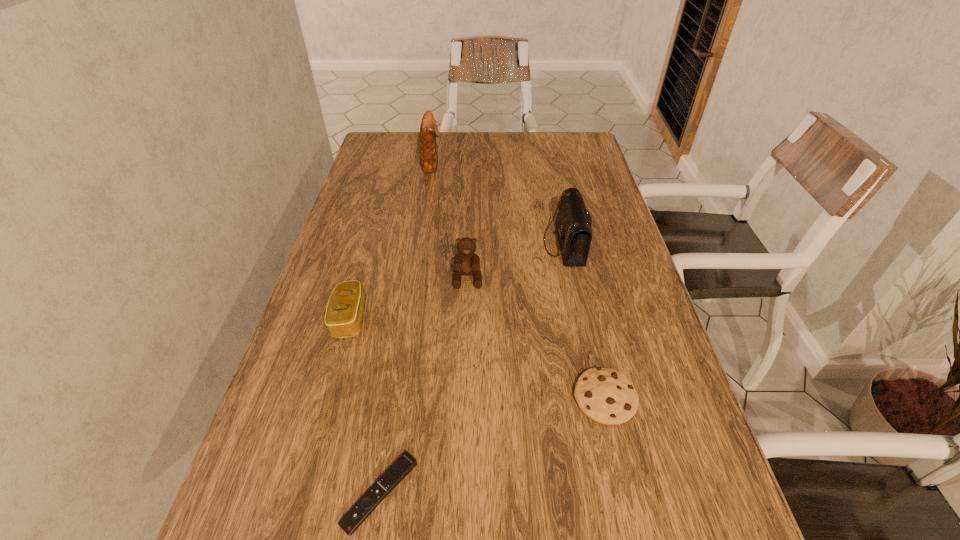
The image size is (960, 540). I want to click on free point between the cookie and the farthest object, so click(x=518, y=281).

I want to click on free space between the third nearest object and the farthest clutch bag, so click(391, 241).

The height and width of the screenshot is (540, 960). I want to click on free space between the shortest clutch bag and the cookie, so click(477, 358).

Where is `vacant point located between the second shortest object and the leftmost clutch bag`? This screenshot has width=960, height=540. vacant point located between the second shortest object and the leftmost clutch bag is located at coordinates [477, 358].

This screenshot has width=960, height=540. In order to click on vacant area that lies between the third farthest object and the shortest clutch bag in this screenshot , I will do `click(409, 299)`.

The width and height of the screenshot is (960, 540). I want to click on free space between the fourth farthest object and the second clutch bag from right to left, so click(x=391, y=241).

This screenshot has height=540, width=960. I want to click on free space between the third farthest object and the second nearest clutch bag, so click(x=516, y=261).

Where is `free spot between the teddy bear and the third nearest object`? free spot between the teddy bear and the third nearest object is located at coordinates (409, 299).

The height and width of the screenshot is (540, 960). What are the coordinates of `free spot between the tallest clutch bag and the nearest object` in the screenshot? It's located at (406, 328).

Locate an element on the screen. object identified as the second closest to the second clutch bag from left to right is located at coordinates (466, 262).